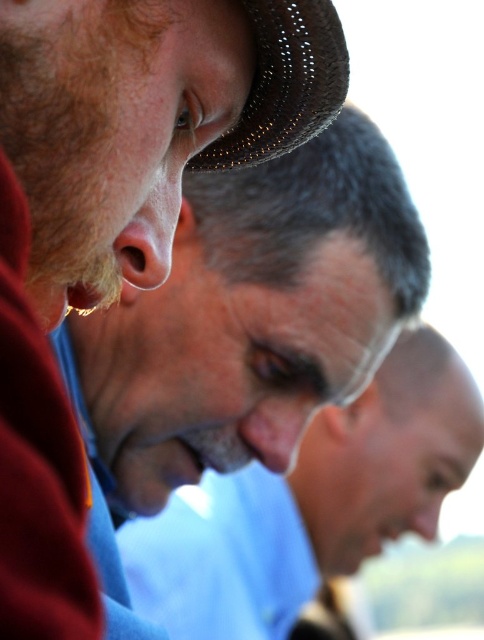
Question: Which object is closer to the camera taking this photo?

Choices:
 (A) gray matte face at center
 (B) brown textured hat at upper left

Answer: (B)

Question: Among these objects, which one is farthest from the camera?

Choices:
 (A) brown textured hat at upper left
 (B) woven straw hat at upper left

Answer: (A)

Question: Is the position of gray matte face at center more distant than that of woven straw hat at upper left?

Choices:
 (A) yes
 (B) no

Answer: (A)

Question: Does brown textured hat at upper left appear on the left side of woven straw hat at upper left?

Choices:
 (A) no
 (B) yes

Answer: (B)

Question: Which object appears farthest from the camera in this image?

Choices:
 (A) gray matte face at center
 (B) woven straw hat at upper left

Answer: (A)

Question: In this image, where is brown textured hat at upper left located relative to woven straw hat at upper left?

Choices:
 (A) below
 (B) above

Answer: (A)